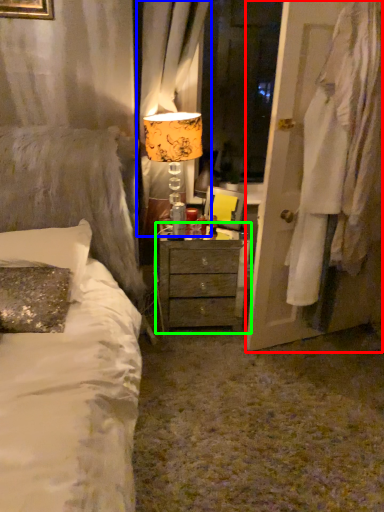
Question: Which object is positioned closest to door (highlighted by a red box)? Select from curtain (highlighted by a blue box) and nightstand (highlighted by a green box).

Choices:
 (A) curtain
 (B) nightstand

Answer: (B)